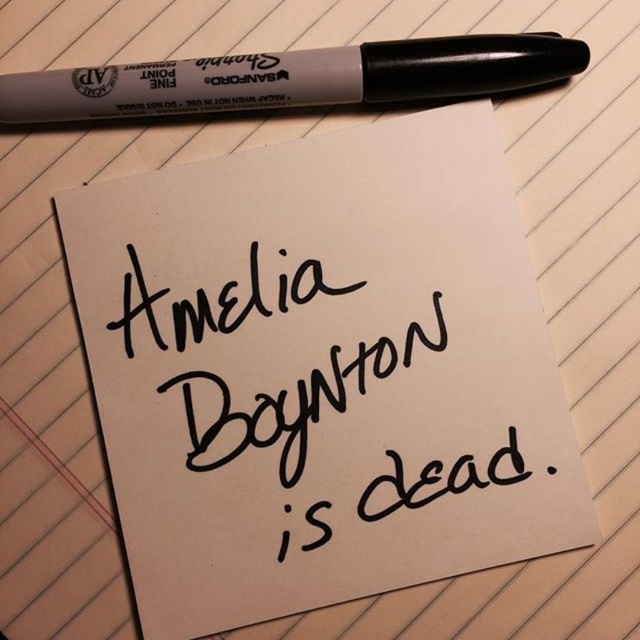
You are looking at the handwritten note and the Sharpie marker on the paper. There are two points marked on the image at coordinates point[248,371] and point[458,480]. Which point is closer to you?

Point[248,371] is closer to you than point[458,480].

You are a detective examining a crime scene. You notice a black handwritten text at center and a black plastic pen at top. Which object appears bigger in the image?

The black handwritten text at center is larger in size than the black plastic pen at top, so the black handwritten text at center appears bigger in the image.